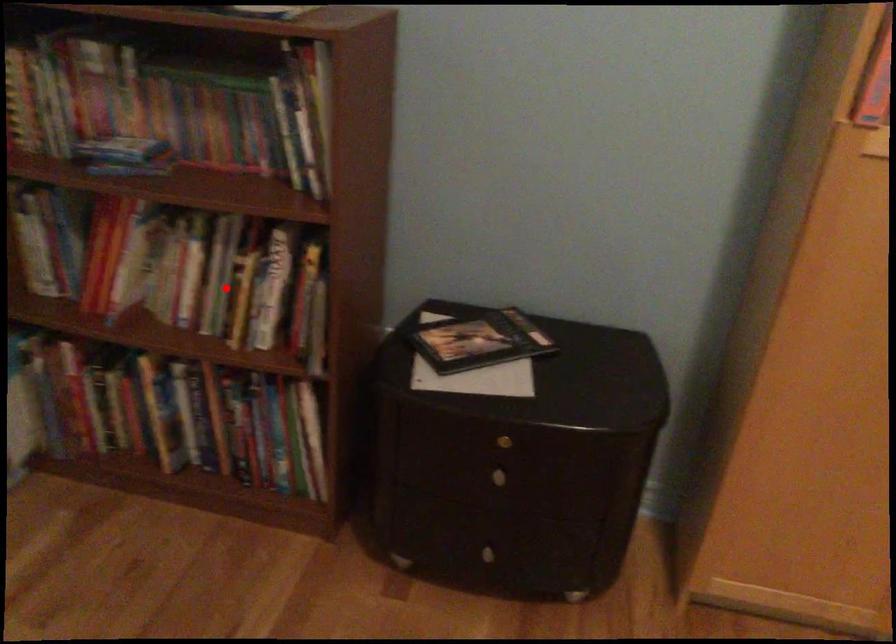
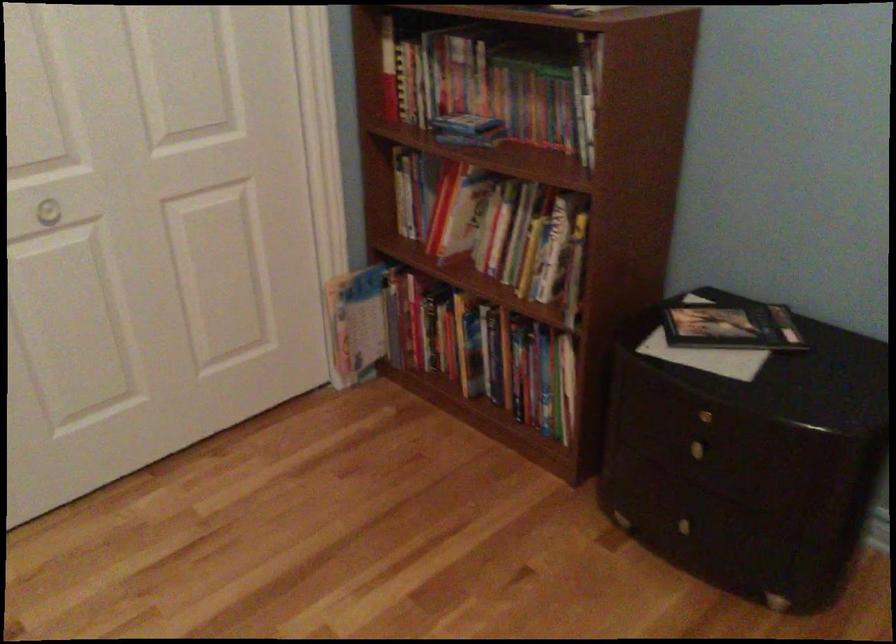
Question: I am providing you with two images of the same scene from different viewpoints. A red point is shown in image1. For the corresponding object point in image2, is it positioned nearer or farther from the camera?

Choices:
 (A) Nearer
 (B) Farther

Answer: (B)